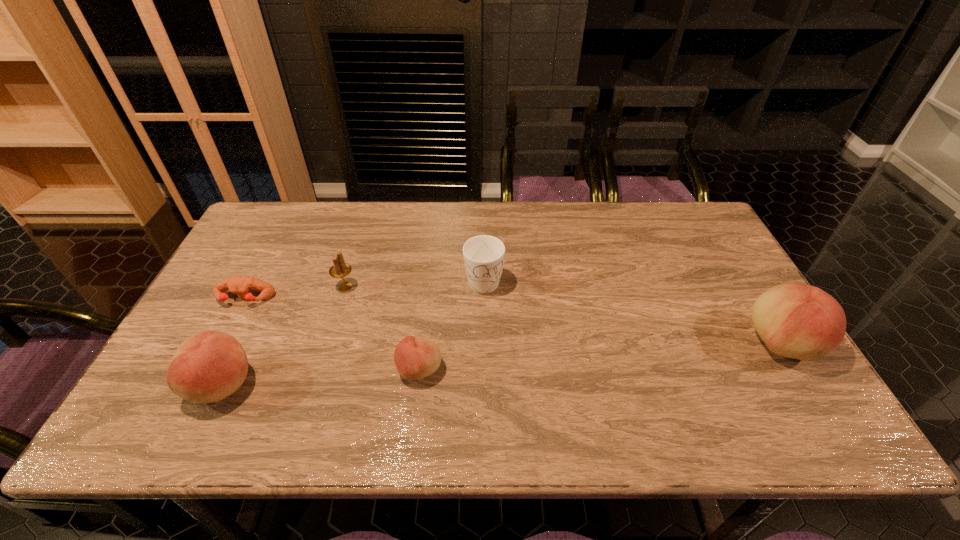
Identify the location of vacant space located 0.120m on the side of the mug with the handle. (484, 332).

Image resolution: width=960 pixels, height=540 pixels. What are the coordinates of `vacant space located with the gloves of the shortest object facing forward` in the screenshot? It's located at (209, 367).

The image size is (960, 540). I want to click on free point located on the back of the candle holder, so click(366, 220).

Find the location of a particular element. This screenshot has height=540, width=960. peach at the left edge is located at coordinates (209, 366).

I want to click on puncher located in the left edge section of the desktop, so click(x=241, y=286).

Identify the location of object positioned at the right edge. Image resolution: width=960 pixels, height=540 pixels. pyautogui.click(x=800, y=321).

Locate an element on the screen. The width and height of the screenshot is (960, 540). object that is at the near left corner is located at coordinates pyautogui.click(x=209, y=366).

The height and width of the screenshot is (540, 960). In order to click on object located at the near right corner in this screenshot , I will do `click(800, 321)`.

You are a GUI agent. You are given a task and a screenshot of the screen. Output one action in this format:
    pyautogui.click(x=<x>, y=<y>)
    Task: Click on the free space at the far edge of the desktop
    
    Given the screenshot: What is the action you would take?
    pyautogui.click(x=312, y=208)

The width and height of the screenshot is (960, 540). What are the coordinates of `vacant space at the near edge of the desktop` in the screenshot? It's located at (447, 397).